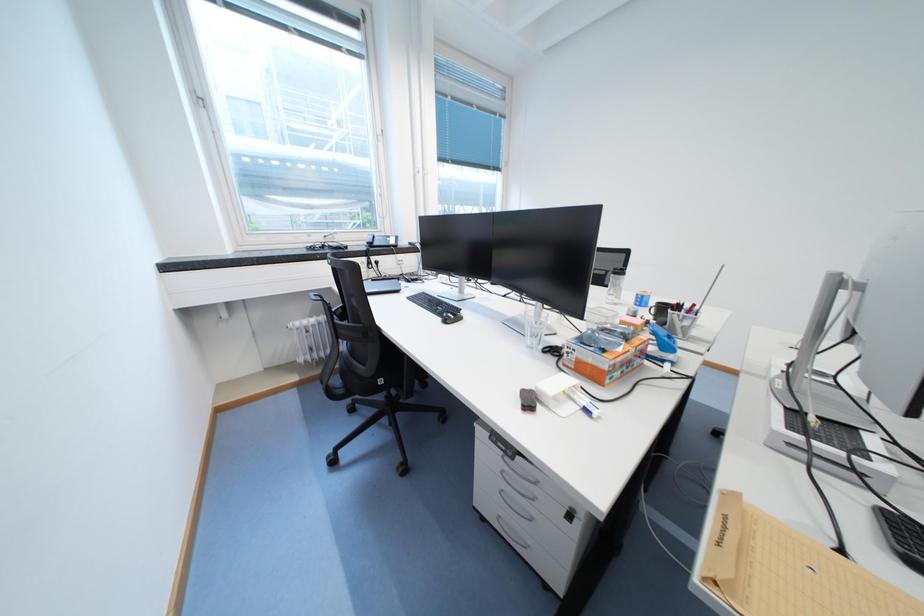
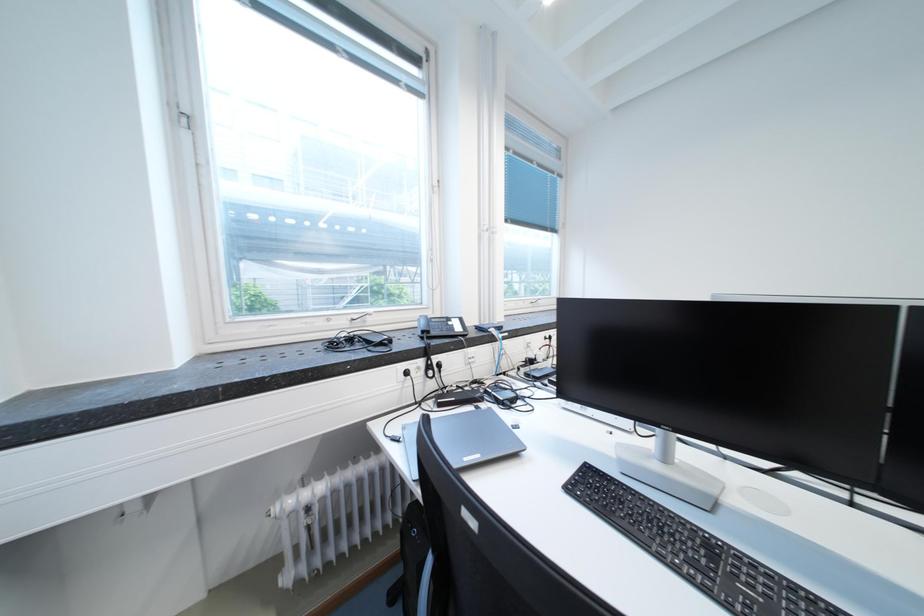
In a continuous first-person perspective shot, in which direction is the camera moving?

The movement direction of the cameraman is left, forward.